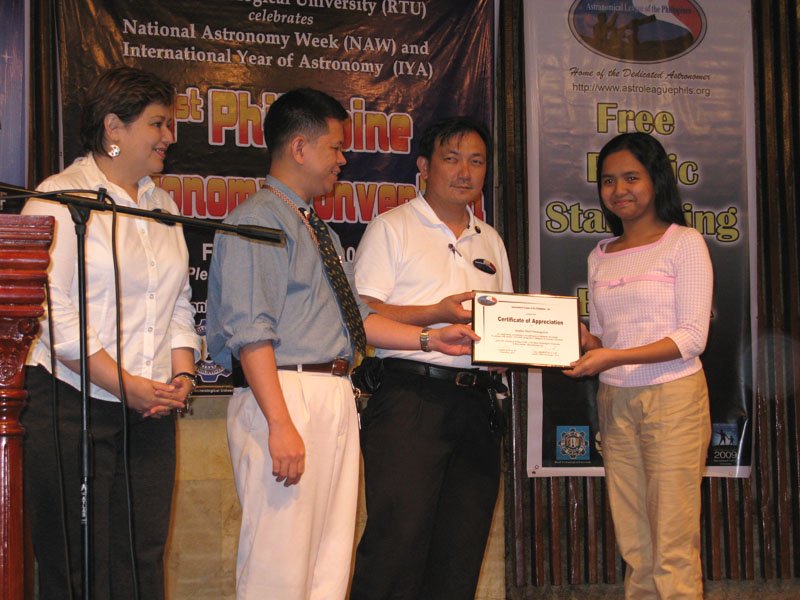
At what (x,y) coordinates should I click in order to perform the action: click on frame. Please return your answer as a coordinate pair (x, y). Image resolution: width=800 pixels, height=600 pixels. Looking at the image, I should click on (510, 360).